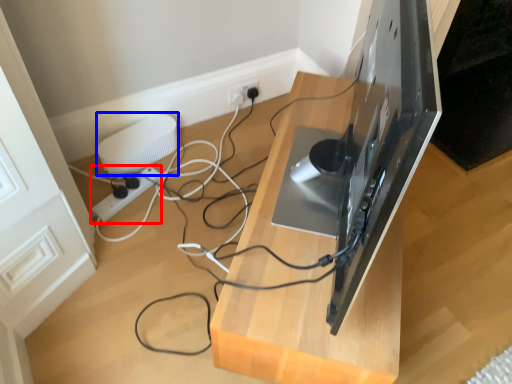
Question: Which object is further to the camera taking this photo, extension cord (highlighted by a red box) or appliance (highlighted by a blue box)?

Choices:
 (A) extension cord
 (B) appliance

Answer: (B)